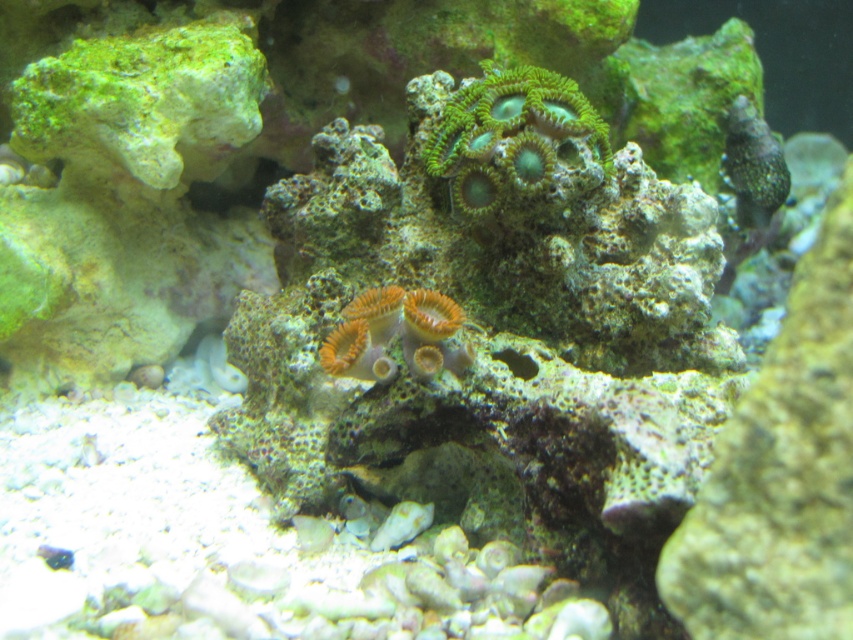
Does green coral at upper center appear on the right side of orange soft coral at center?

Correct, you'll find green coral at upper center to the right of orange soft coral at center.

Describe the element at coordinates (511, 136) in the screenshot. I see `green coral at upper center` at that location.

Does point (573, 124) come in front of point (434, 308)?

No, it is not.

Identify the location of green coral at upper center. tap(511, 136).